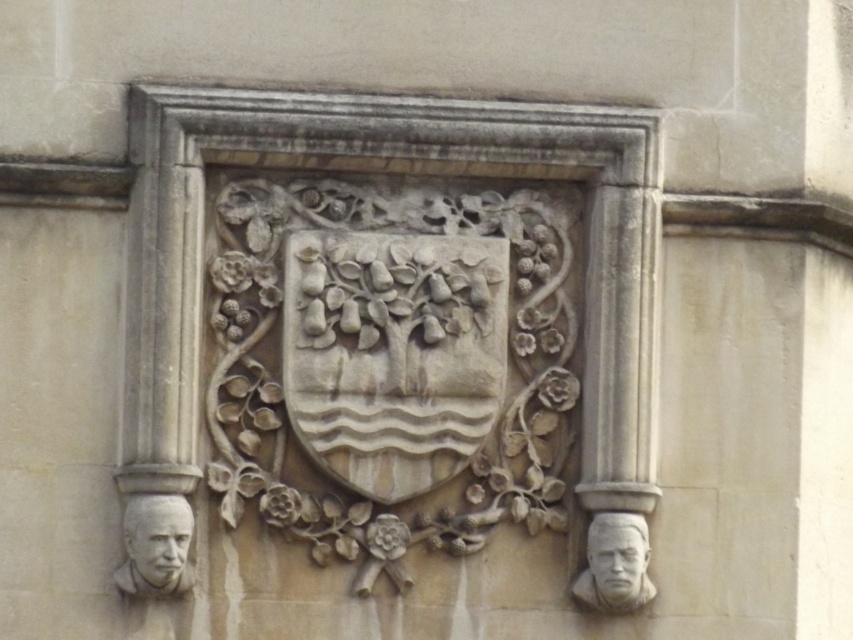
You are an art conservator examining the stone relief. You notice the gray stone bust at lower right and the gray stone face at lower left. Based on their positions, which one is located to the right side of the other?

The gray stone bust at lower right is to the right of the gray stone face at lower left.

Looking at this image, you are an art conservator examining the stone relief. You need to determine if the gray stone bust at lower left and the stone carved face at lower right can both fit on a transport cart that is 1.2 meters in height. Based on their sizes, will both items fit?

The gray stone bust at lower left is much taller than the stone carved face at lower right. Since the cart has a 1.2 meter height limit, if the taller gray stone bust at lower left exceeds this height, then the stone carved face at lower right might still fit individually, but both cannot be transported together if the taller one is over the limit. However, without specific measurements, we cannot confirm exact fit.

You are an art conservator examining the stone relief. You need to determine which of the two sculptures, the gray stone bust at lower left or the stone carved face at lower right, requires more material for restoration due to its size. Which one would need more material?

The gray stone bust at lower left requires more material for restoration because it has a larger size compared to the stone carved face at lower right.